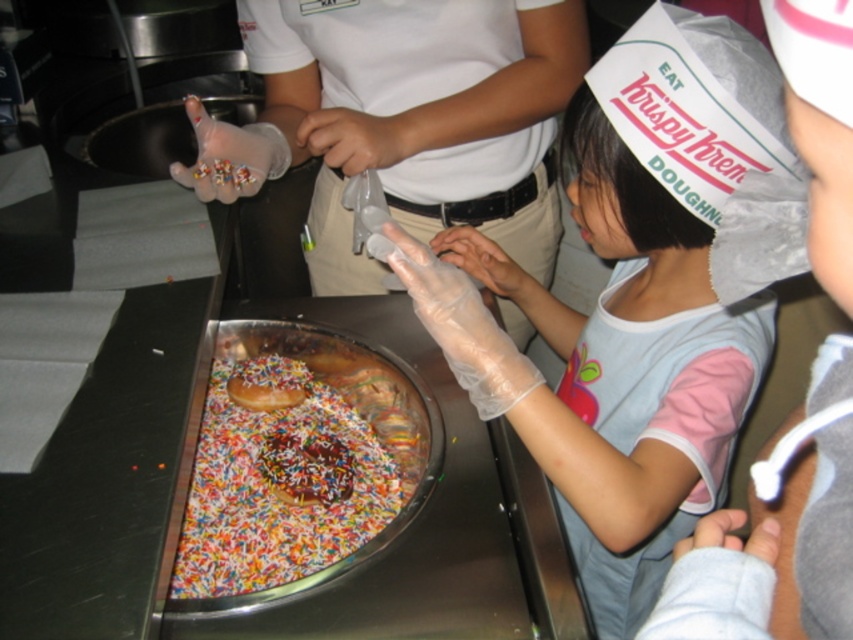
Is transparent plastic glove at upper center to the right of colorful sprinkled donuts at center from the viewer's perspective?

Yes, transparent plastic glove at upper center is to the right of colorful sprinkled donuts at center.

Does transparent plastic glove at upper center appear on the left side of colorful sprinkled donuts at center?

No, transparent plastic glove at upper center is not to the left of colorful sprinkled donuts at center.

Image resolution: width=853 pixels, height=640 pixels. In order to click on transparent plastic glove at upper center in this screenshot , I will do pyautogui.click(x=618, y=324).

Find the location of `transparent plastic glove at upper center`. transparent plastic glove at upper center is located at coordinates (618, 324).

Locate an element on the screen. transparent plastic glove at upper center is located at coordinates (618, 324).

Who is lower down, transparent plastic glove at upper center or chocolate-coated donut at center?

chocolate-coated donut at center is lower down.

Image resolution: width=853 pixels, height=640 pixels. Describe the element at coordinates (618, 324) in the screenshot. I see `transparent plastic glove at upper center` at that location.

Where is `transparent plastic glove at upper center`? transparent plastic glove at upper center is located at coordinates (618, 324).

Does transparent plastic glove at upper center appear under glazed chocolate donut at center?

No, transparent plastic glove at upper center is not below glazed chocolate donut at center.

This screenshot has height=640, width=853. Describe the element at coordinates (618, 324) in the screenshot. I see `transparent plastic glove at upper center` at that location.

Which is in front, point (590, 385) or point (306, 372)?

Point (590, 385) is in front.

What are the coordinates of `transparent plastic glove at upper center` in the screenshot? It's located at (618, 324).